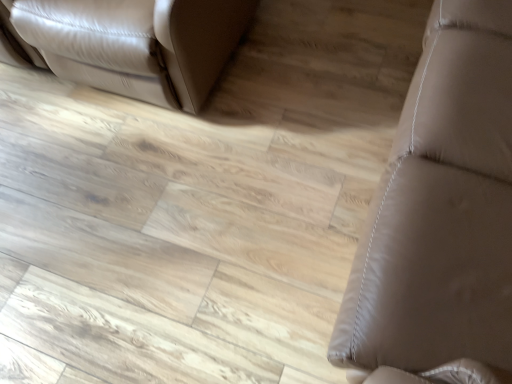
Question: Is matte leather couch at upper left, the first furniture in the left-to-right sequence, with brown leather couch at right, the second furniture from the left?

Choices:
 (A) no
 (B) yes

Answer: (A)

Question: Can you confirm if matte leather couch at upper left, which is counted as the 2th furniture, starting from the right, is taller than brown leather couch at right, the second furniture from the left?

Choices:
 (A) yes
 (B) no

Answer: (B)

Question: Is the position of matte leather couch at upper left, which is counted as the 2th furniture, starting from the right, less distant than that of brown leather couch at right, the second furniture from the left?

Choices:
 (A) yes
 (B) no

Answer: (B)

Question: Is brown leather couch at right, which is the 1th furniture from right to left, completely or partially inside matte leather couch at upper left, the first furniture in the left-to-right sequence?

Choices:
 (A) yes
 (B) no

Answer: (B)

Question: Is matte leather couch at upper left, which is counted as the 2th furniture, starting from the right, positioned beyond the bounds of brown leather couch at right, which is the 1th furniture from right to left?

Choices:
 (A) no
 (B) yes

Answer: (B)

Question: Is matte leather couch at upper left, which is counted as the 2th furniture, starting from the right, looking in the opposite direction of brown leather couch at right, the second furniture from the left?

Choices:
 (A) no
 (B) yes

Answer: (A)

Question: Is brown leather couch at right, which is the 1th furniture from right to left, thinner than matte leather couch at upper left, which is counted as the 2th furniture, starting from the right?

Choices:
 (A) yes
 (B) no

Answer: (A)

Question: Is brown leather couch at right, which is the 1th furniture from right to left, closer to the viewer compared to matte leather couch at upper left, the first furniture in the left-to-right sequence?

Choices:
 (A) yes
 (B) no

Answer: (A)

Question: Is brown leather couch at right, the second furniture from the left, positioned far away from matte leather couch at upper left, the first furniture in the left-to-right sequence?

Choices:
 (A) yes
 (B) no

Answer: (B)

Question: Is brown leather couch at right, which is the 1th furniture from right to left, facing away from matte leather couch at upper left, which is counted as the 2th furniture, starting from the right?

Choices:
 (A) yes
 (B) no

Answer: (B)

Question: Does brown leather couch at right, which is the 1th furniture from right to left, have a larger size compared to matte leather couch at upper left, the first furniture in the left-to-right sequence?

Choices:
 (A) yes
 (B) no

Answer: (A)

Question: Does brown leather couch at right, the second furniture from the left, appear on the right side of matte leather couch at upper left, the first furniture in the left-to-right sequence?

Choices:
 (A) no
 (B) yes

Answer: (B)

Question: Considering the positions of point (95, 18) and point (424, 155), is point (95, 18) closer or farther from the camera than point (424, 155)?

Choices:
 (A) farther
 (B) closer

Answer: (A)